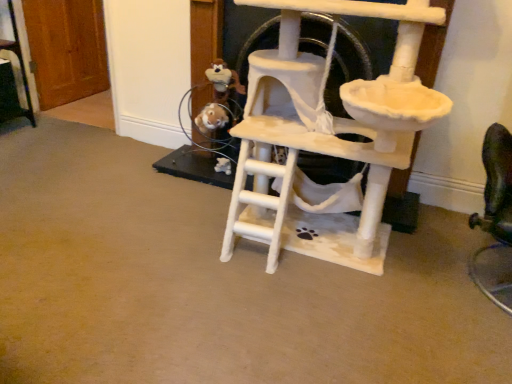
In order to click on white fabric cat tree at center in this screenshot , I will do `click(328, 134)`.

Describe the element at coordinates (328, 134) in the screenshot. This screenshot has height=384, width=512. I see `white fabric cat tree at center` at that location.

At what (x,y) coordinates should I click in order to perform the action: click on white fabric cat tree at center. Please return your answer as a coordinate pair (x, y). Looking at the image, I should click on [328, 134].